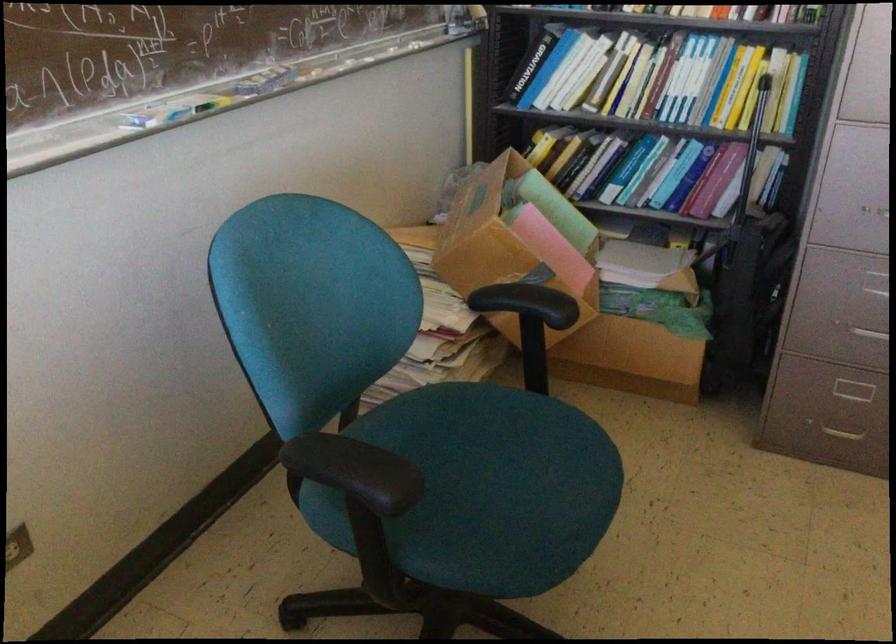
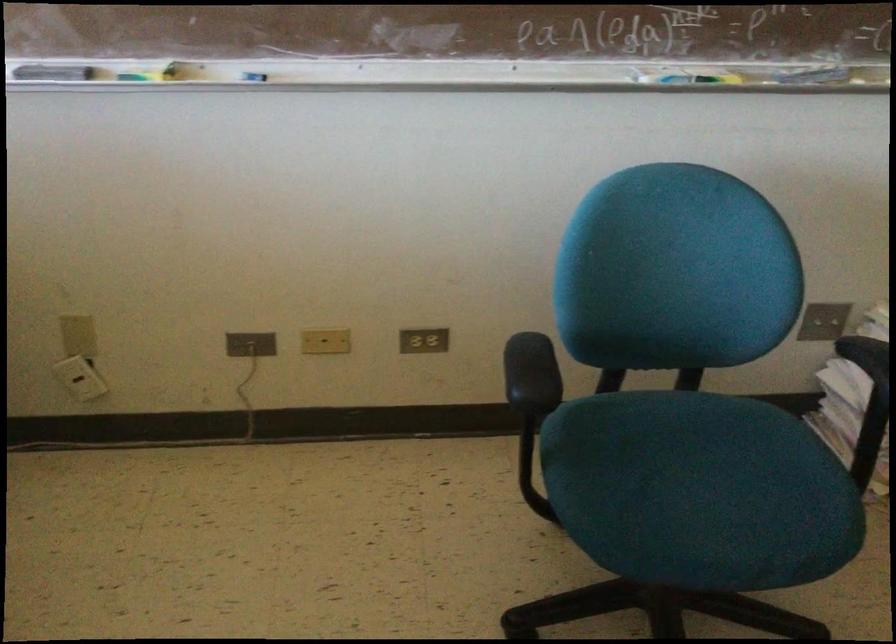
Find the pixel in the second image that matches [510,486] in the first image.

(700, 491)